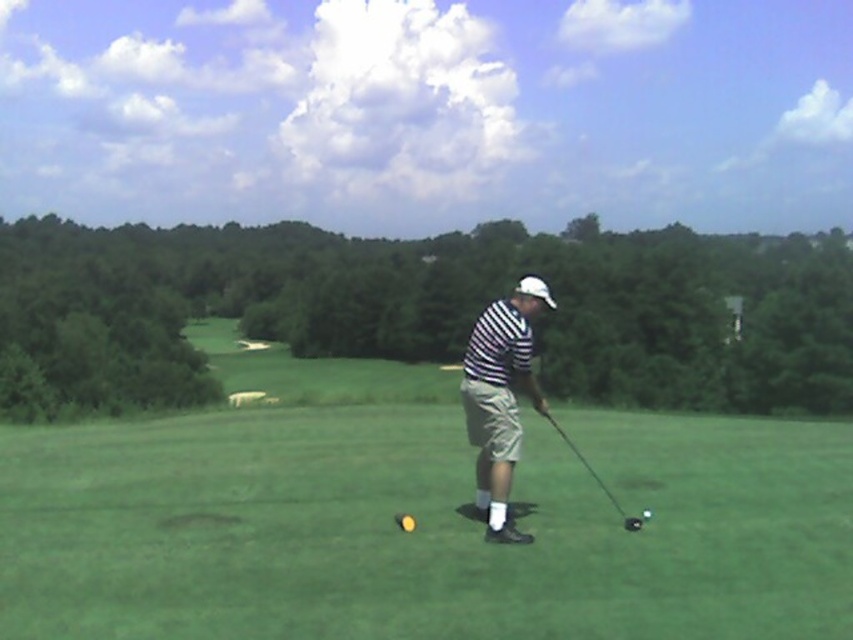
Question: Which of the following is the closest to the observer?

Choices:
 (A) green grass at center
 (B) striped fabric shirt at center
 (C) shiny black golf club at center

Answer: (A)

Question: In this image, where is yellow matte golf ball at center located relative to shiny black golf ball at center?

Choices:
 (A) left
 (B) right

Answer: (A)

Question: Estimate the real-world distances between objects in this image. Which object is farther from the striped cotton polo shirt at center?

Choices:
 (A) shiny black golf ball at center
 (B) green grass at center
 (C) yellow matte golf ball at center
 (D) shiny black golf club at center

Answer: (B)

Question: Is striped fabric shirt at center positioned in front of shiny black golf ball at center?

Choices:
 (A) no
 (B) yes

Answer: (B)

Question: From the image, what is the correct spatial relationship of yellow matte golf ball at center in relation to shiny black golf ball at center?

Choices:
 (A) below
 (B) above

Answer: (A)

Question: Which of the following is the farthest from the observer?

Choices:
 (A) (395, 515)
 (B) (496, 401)
 (C) (576, 451)
 (D) (99, 506)

Answer: (C)